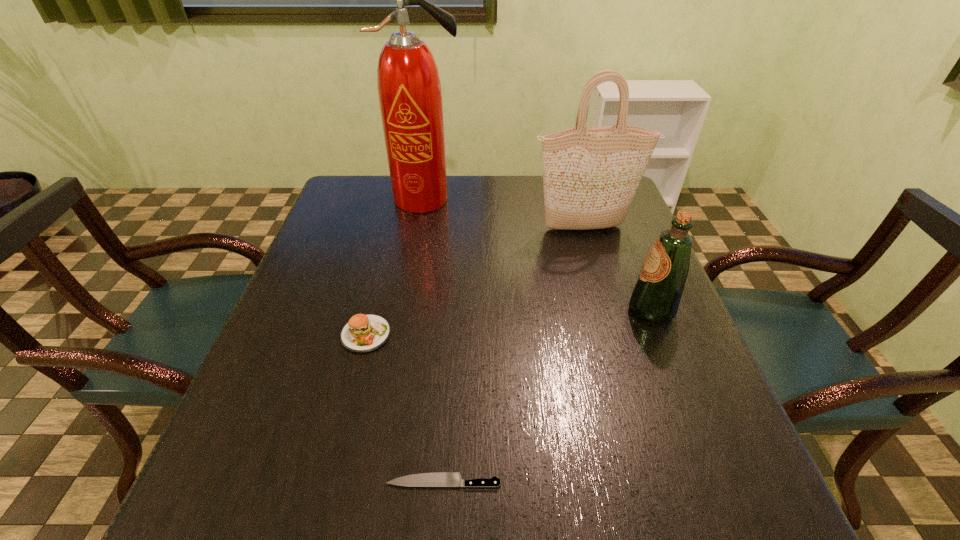
Identify the location of vacant space positioned 0.230m on the front-facing side of the third shortest object. (524, 309).

This screenshot has width=960, height=540. Identify the location of vacant region located 0.240m on the front-facing side of the third shortest object. (520, 309).

You are a GUI agent. You are given a task and a screenshot of the screen. Output one action in this format:
    pyautogui.click(x=<x>, y=<y>)
    Task: Click on the free space located 0.360m on the front-facing side of the third shortest object
    Image resolution: width=960 pixels, height=540 pixels.
    Given the screenshot: What is the action you would take?
    pyautogui.click(x=466, y=309)

Where is `free space located on the back of the patty`? This screenshot has width=960, height=540. free space located on the back of the patty is located at coordinates (388, 246).

Where is `free location located on the back of the steak knife`? Image resolution: width=960 pixels, height=540 pixels. free location located on the back of the steak knife is located at coordinates 451,359.

This screenshot has height=540, width=960. Find the location of `object present at the far edge`. object present at the far edge is located at coordinates (409, 89).

Locate an element on the screen. The width and height of the screenshot is (960, 540). object that is at the near edge is located at coordinates (434, 479).

Where is `object located at the left edge`? The height and width of the screenshot is (540, 960). object located at the left edge is located at coordinates (363, 333).

The image size is (960, 540). In order to click on shopping bag positioned at the right edge in this screenshot , I will do `click(590, 174)`.

Where is `olive oil present at the right edge`? The image size is (960, 540). olive oil present at the right edge is located at coordinates (656, 295).